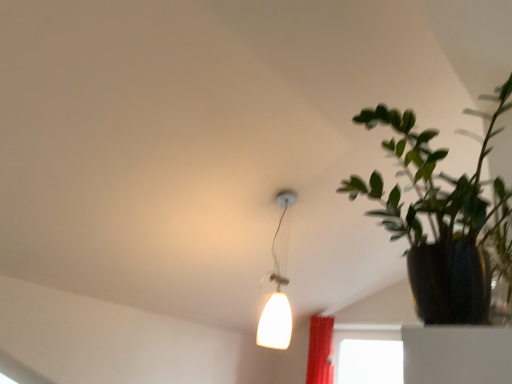
Question: Is white glossy lampshade at upper center not close to green matte plant at right?

Choices:
 (A) no
 (B) yes

Answer: (B)

Question: Would you say green matte plant at right is part of white glossy lampshade at upper center's contents?

Choices:
 (A) no
 (B) yes

Answer: (A)

Question: From the image's perspective, is white glossy lampshade at upper center on top of green matte plant at right?

Choices:
 (A) no
 (B) yes

Answer: (A)

Question: Does white glossy lampshade at upper center have a lesser width compared to green matte plant at right?

Choices:
 (A) yes
 (B) no

Answer: (A)

Question: Considering the relative sizes of white glossy lampshade at upper center and green matte plant at right in the image provided, is white glossy lampshade at upper center wider than green matte plant at right?

Choices:
 (A) no
 (B) yes

Answer: (A)

Question: Is white glossy lampshade at upper center in front of green matte plant at right?

Choices:
 (A) no
 (B) yes

Answer: (A)

Question: From the image's perspective, is green matte plant at right on white glossy lampshade at upper center?

Choices:
 (A) yes
 (B) no

Answer: (A)

Question: Does green matte plant at right have a smaller size compared to white glossy lampshade at upper center?

Choices:
 (A) yes
 (B) no

Answer: (B)

Question: From a real-world perspective, is green matte plant at right located higher than white glossy lampshade at upper center?

Choices:
 (A) yes
 (B) no

Answer: (B)

Question: Does green matte plant at right have a greater height compared to white glossy lampshade at upper center?

Choices:
 (A) no
 (B) yes

Answer: (A)

Question: Does green matte plant at right have a lesser height compared to white glossy lampshade at upper center?

Choices:
 (A) no
 (B) yes

Answer: (B)

Question: Is green matte plant at right to the left of white glossy lampshade at upper center from the viewer's perspective?

Choices:
 (A) yes
 (B) no

Answer: (B)

Question: In terms of size, does white glossy lampshade at upper center appear bigger or smaller than green matte plant at right?

Choices:
 (A) small
 (B) big

Answer: (A)